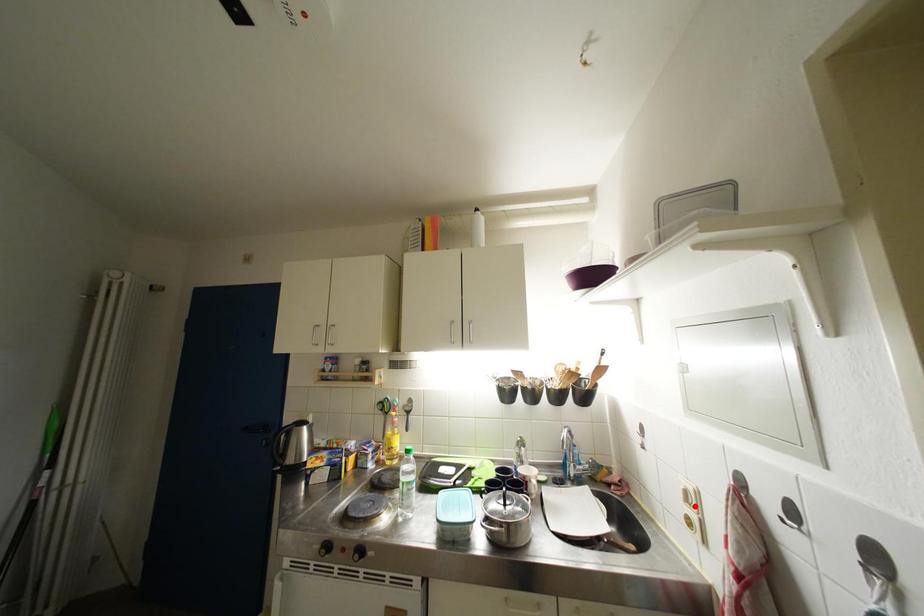
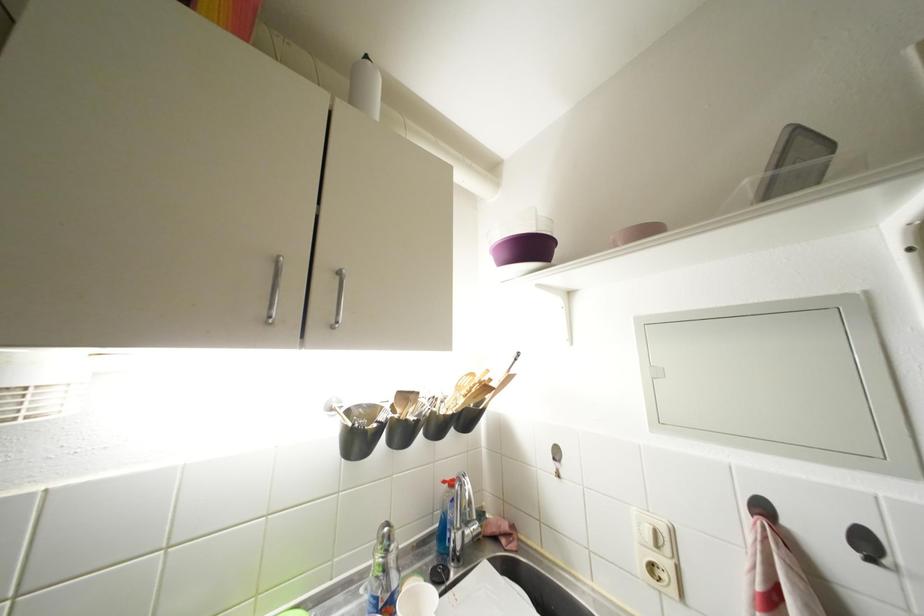
Locate, in the second image, the point that corresponds to the highlighted location in the first image.

(663, 549)